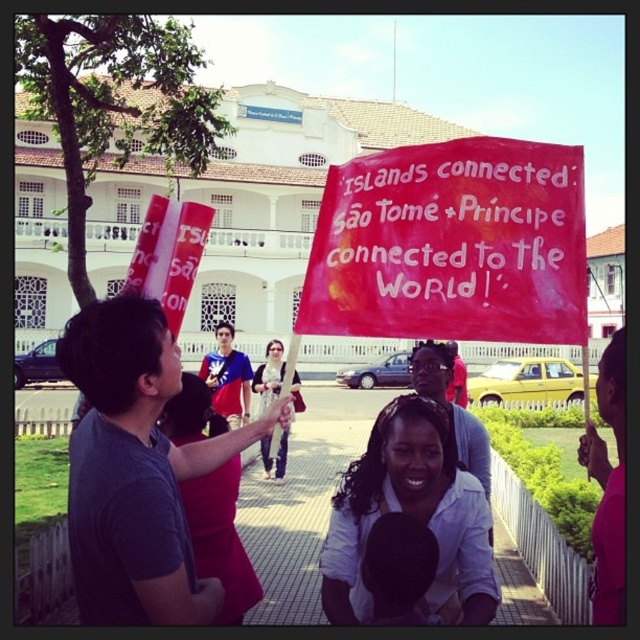
You are a photographer trying to capture a clear shot of the matte red dress at center without the red fabric banner at center blocking it. What adjustment could you make to your camera angle?

The red fabric banner at center is above the matte red dress at center, so tilting the camera downward slightly would allow you to frame the dress without the banner obstructing the view.

You are standing at the center of the walkway and want to move towards the point labeled as point (480, 177). However, there is an obstacle at point (228, 512). Can you reach your destination without going around the obstacle?

Yes, because point (480, 177) is in front of point (228, 512), so you can reach it without needing to go around the obstacle.